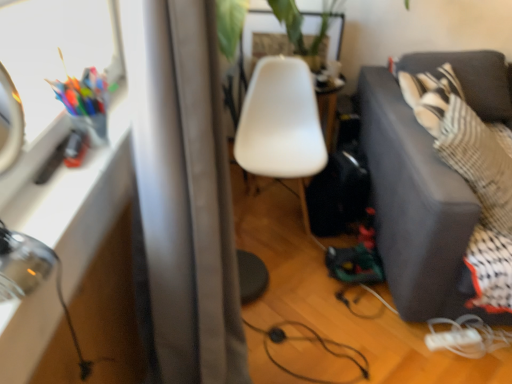
At what (x,y) coordinates should I click in order to perform the action: click on vacant space in front of white matte extension cord at lower right. Please return your answer as a coordinate pair (x, y). Looking at the image, I should click on (459, 368).